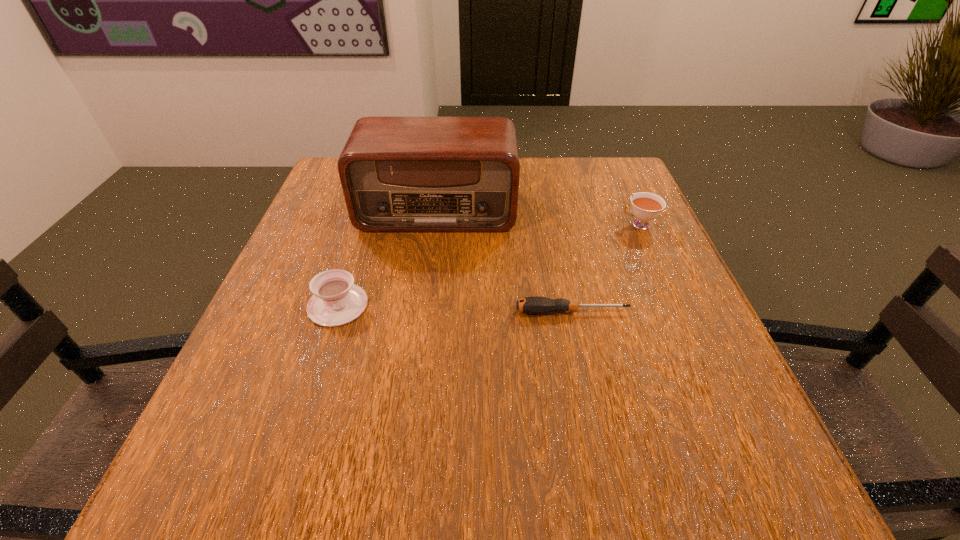
Identify the location of vacant space at the far right corner of the desktop. The height and width of the screenshot is (540, 960). (600, 195).

Where is `free space at the near right corner of the desktop`? free space at the near right corner of the desktop is located at coordinates (663, 461).

Find the location of a particular element. The image size is (960, 540). vacant area that lies between the tallest object and the screwdriver is located at coordinates (505, 261).

Where is `free space between the left teacup and the right teacup`? This screenshot has width=960, height=540. free space between the left teacup and the right teacup is located at coordinates (489, 265).

Where is `vacant space that is in between the rightmost object and the nearer teacup`? Image resolution: width=960 pixels, height=540 pixels. vacant space that is in between the rightmost object and the nearer teacup is located at coordinates (489, 265).

The width and height of the screenshot is (960, 540). Find the location of `vacant space in between the shortest object and the right teacup`. vacant space in between the shortest object and the right teacup is located at coordinates (606, 268).

Identify the location of empty space that is in between the tallest object and the rightmost object. (538, 218).

I want to click on vacant space that's between the nearer teacup and the shortest object, so click(x=455, y=308).

You are a GUI agent. You are given a task and a screenshot of the screen. Output one action in this format:
    pyautogui.click(x=<x>, y=<y>)
    Task: Click on the free area in between the shortest object and the radio receiver
    This screenshot has height=540, width=960.
    Given the screenshot: What is the action you would take?
    pyautogui.click(x=505, y=261)

In order to click on free area in between the farther teacup and the tallest object in this screenshot , I will do `click(538, 218)`.